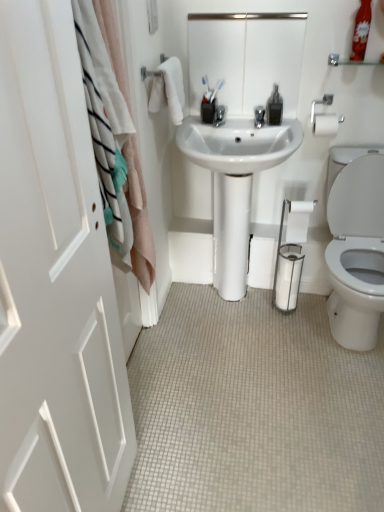
Question: Is white soft towel at upper left to the left or to the right of white fabric curtain at left in the image?

Choices:
 (A) left
 (B) right

Answer: (B)

Question: Choose the correct answer: Is white soft towel at upper left inside white fabric curtain at left or outside it?

Choices:
 (A) outside
 (B) inside

Answer: (A)

Question: Which is farther from the white glossy sink at center?

Choices:
 (A) clear plastic bottle at upper right
 (B) white fabric curtain at left
 (C) white matte door at left
 (D) clear glass shelf at upper right
 (E) white glossy mirror at upper center

Answer: (C)

Question: Which object is positioned closest to the white tile floor at lower center?

Choices:
 (A) white glossy sink at center
 (B) white paper roll at lower right
 (C) clear plastic bottle at upper right
 (D) silver metallic towel bar at upper right
 (E) white glossy mirror at upper center

Answer: (A)